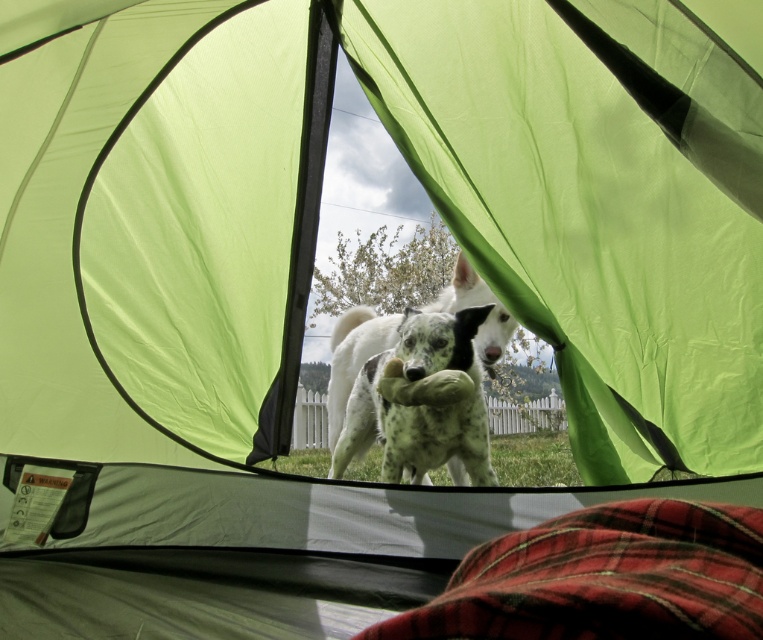
You are setting up a camp inside the tent and want to place the red plaid blanket at lower right and the speckled fur dog at center in a way that they both fit on the tent floor. Given that the tent floor has limited space, which object should you adjust to ensure they both fit?

The red pliad blanket at lower right is thinner than the speckled fur dog at center, so you should adjust the position of the speckled fur dog at center to make more space for the thinner red plaid blanket at lower right.

You are setting up a tent and want to place a red plaid blanket at lower right and a speckled fur dog at center. Based on the scene description, which object is taller?

The speckled fur dog at center is taller than the red plaid blanket at lower right.

You are setting up a small campfire between the red plaid blanket at lower right and the speckled fur dog at center. The campfire requires a 5 feet radius for safety. Is there enough space between them to safely place the campfire?

The distance between the red plaid blanket at lower right and the speckled fur dog at center is 6.25 feet. Since the campfire needs a 5 feet radius, the total space required is 10 feet. However, the available space is only 6.25 feet, so there isn